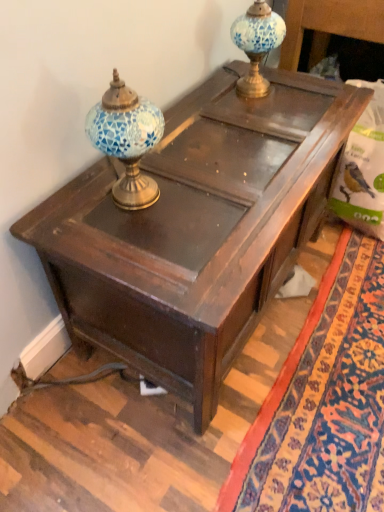
The width and height of the screenshot is (384, 512). What are the coordinates of `blank space to the left of blue mosaic glass lamp at upper left, the 2th candle holder from the back` in the screenshot? It's located at (76, 200).